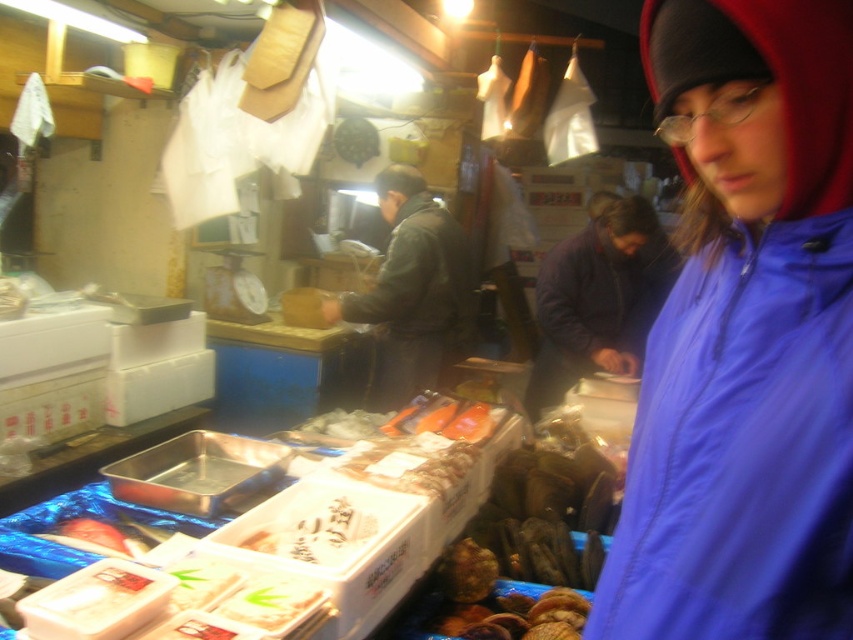
This screenshot has height=640, width=853. Describe the element at coordinates (598, 298) in the screenshot. I see `dark blue jacket at center` at that location.

Can you confirm if dark blue jacket at center is thinner than leather jacket at center?

In fact, dark blue jacket at center might be wider than leather jacket at center.

Between point (561, 308) and point (378, 326), which one is positioned behind?

The point (378, 326) is more distant.

Where is `dark blue jacket at center`? This screenshot has height=640, width=853. dark blue jacket at center is located at coordinates (598, 298).

Who is lower down, blue fabric jacket at center or leather jacket at center?

blue fabric jacket at center

Where is `blue fabric jacket at center`? This screenshot has height=640, width=853. blue fabric jacket at center is located at coordinates (746, 337).

The height and width of the screenshot is (640, 853). Find the location of `blue fabric jacket at center`. blue fabric jacket at center is located at coordinates (746, 337).

Can you confirm if blue fabric jacket at center is thinner than dark blue jacket at center?

Yes.

Is blue fabric jacket at center to the left of dark blue jacket at center from the viewer's perspective?

Correct, you'll find blue fabric jacket at center to the left of dark blue jacket at center.

Locate an element on the screen. blue fabric jacket at center is located at coordinates (746, 337).